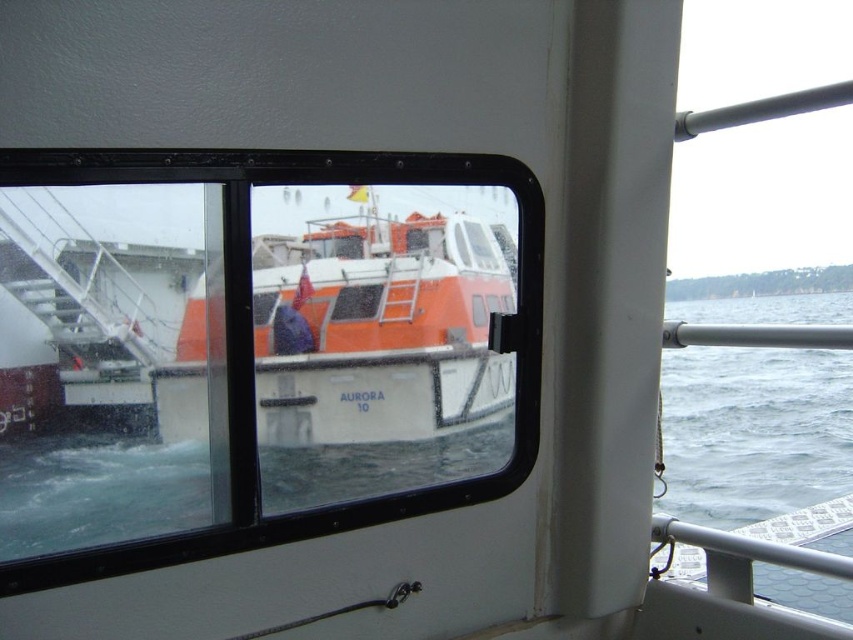
You are on a larger vessel and need to signal the orange matte boat at center. Since the gray water at lower right is choppy, which direction should you aim your signal to reach the boat?

The orange matte boat at center is to the left of the gray water at lower right, so you should aim your signal to the left side of the gray water at lower right to reach the boat.

You are an engineer on the larger vessel and need to determine if the orange matte boat at center can fit through a narrow channel that is as wide as the gray water at lower right. Based on their widths, will it fit?

The orange matte boat at center is thinner than the gray water at lower right, so it can fit through the channel.